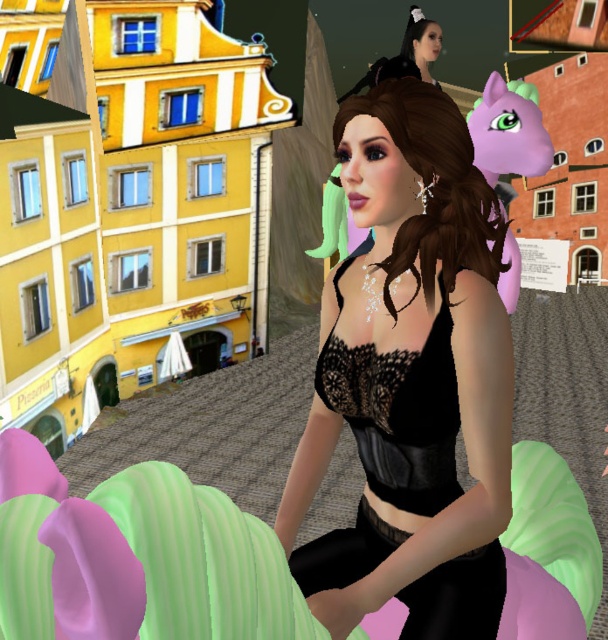
Question: Does green rubber balloon at lower center come in front of black lace dress at center?

Choices:
 (A) yes
 (B) no

Answer: (B)

Question: Does green rubber balloon at lower center come in front of black lace dress at center?

Choices:
 (A) yes
 (B) no

Answer: (B)

Question: Which point is farther to the camera?

Choices:
 (A) green rubber balloon at lower center
 (B) black lace dress at center

Answer: (A)

Question: Which of the following is the farthest from the observer?

Choices:
 (A) black lace dress at center
 (B) green rubber balloon at lower center

Answer: (B)

Question: Does green rubber balloon at lower center have a lesser width compared to black lace dress at center?

Choices:
 (A) yes
 (B) no

Answer: (A)